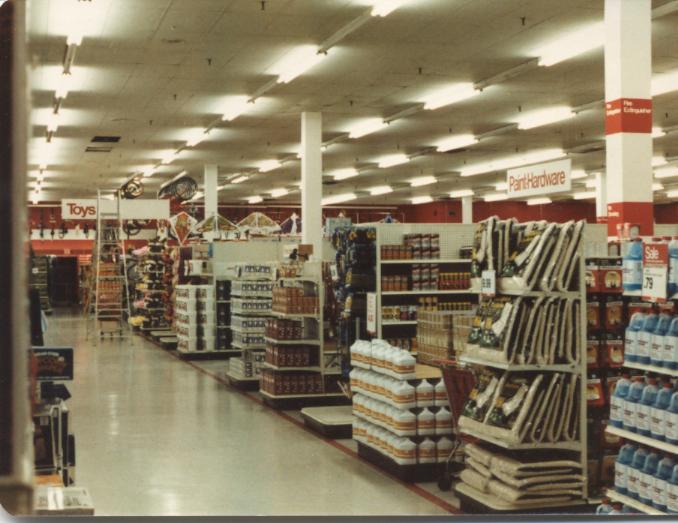
Locate an element on the screen. This screenshot has height=523, width=678. floor is located at coordinates (178, 441).